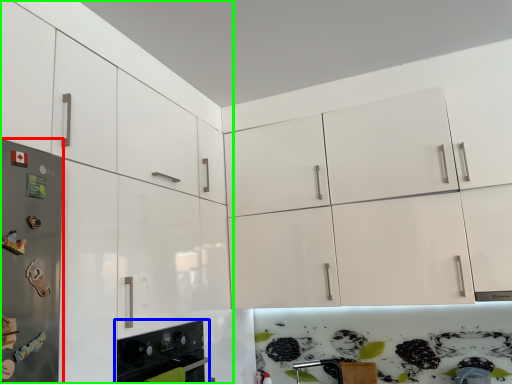
Question: Which is farther away from fridge (highlighted by a red box)? home appliance (highlighted by a blue box) or cabinetry (highlighted by a green box)?

Choices:
 (A) home appliance
 (B) cabinetry

Answer: (A)